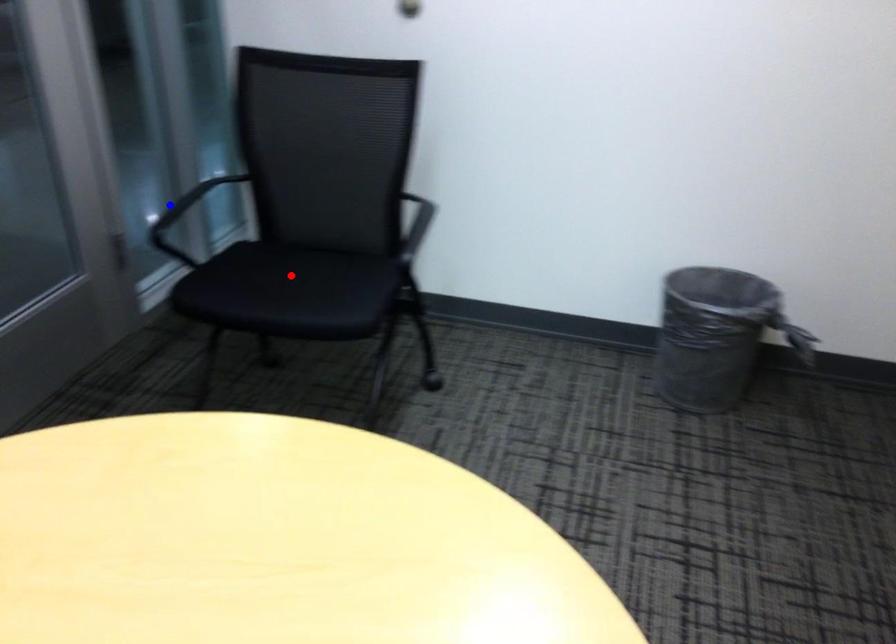
Question: Which of the two points in the image is closer to the camera?

Choices:
 (A) Blue point is closer.
 (B) Red point is closer.

Answer: (B)